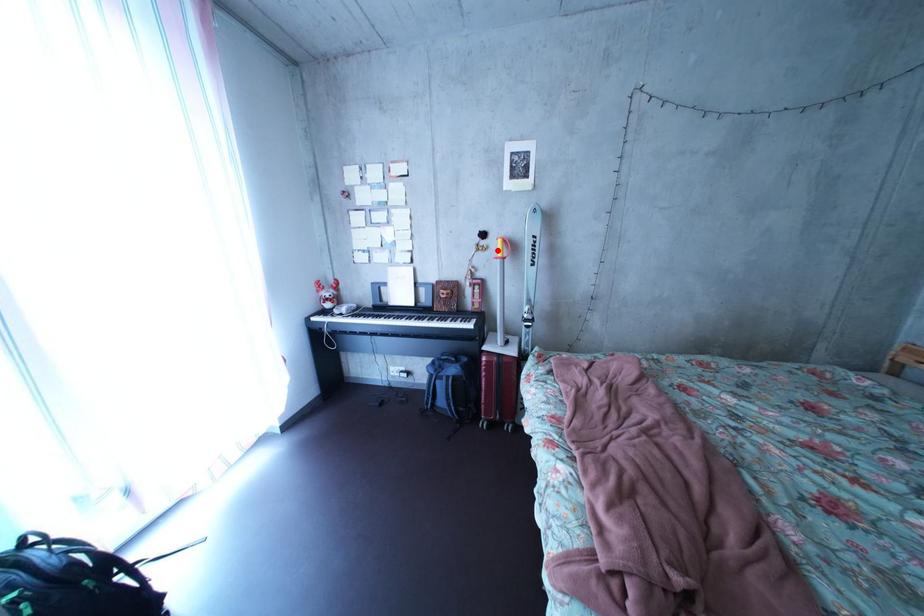
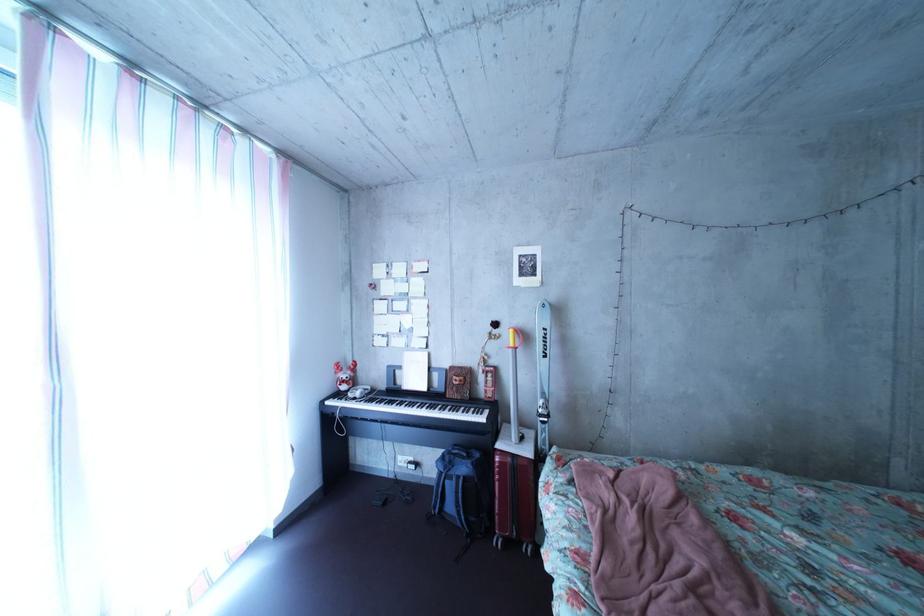
Question: I am providing you with two images of the same scene from different viewpoints. In image1, a red point is highlighted. Considering the same 3D point in image2, which of the following is correct?

Choices:
 (A) It is closer
 (B) It is farther

Answer: (B)